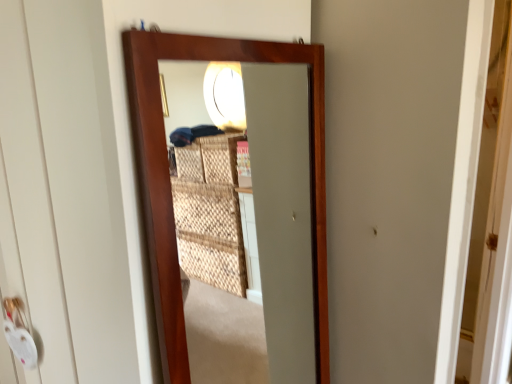
What do you see at coordinates (269, 215) in the screenshot? This screenshot has height=384, width=512. I see `wooden mirror at center` at bounding box center [269, 215].

Identify the location of wooden mirror at center. Image resolution: width=512 pixels, height=384 pixels. (269, 215).

Locate an element on the screen. Image resolution: width=512 pixels, height=384 pixels. wooden mirror at center is located at coordinates (269, 215).